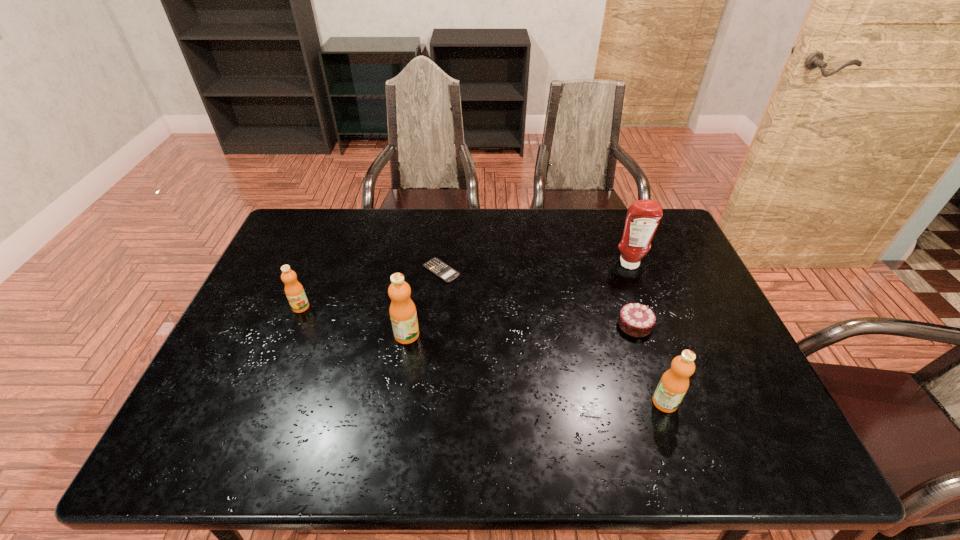
Please determine a free point for an extra orange_juice to ensure balance. Please provide its 2D coordinates. Your answer should be formatted as a tuple, i.e. [(x, y)], where the tuple contains the x and y coordinates of a point satisfying the conditions above.

[(527, 366)]